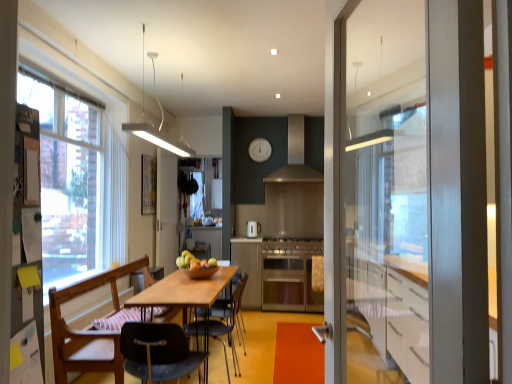
Question: Which direction should I rotate to look at metallic gray chair at center, the 3th chair positioned from the front, — up or down?

Choices:
 (A) up
 (B) down

Answer: (B)

Question: Is the depth of yellow matte apple at center less than that of stainless steel stove at center?

Choices:
 (A) yes
 (B) no

Answer: (A)

Question: Is yellow matte apple at center bigger than stainless steel stove at center?

Choices:
 (A) yes
 (B) no

Answer: (B)

Question: Considering the relative sizes of yellow matte apple at center and stainless steel stove at center in the image provided, is yellow matte apple at center smaller than stainless steel stove at center?

Choices:
 (A) yes
 (B) no

Answer: (A)

Question: Considering the relative sizes of yellow matte apple at center and stainless steel stove at center in the image provided, is yellow matte apple at center thinner than stainless steel stove at center?

Choices:
 (A) yes
 (B) no

Answer: (A)

Question: Does yellow matte apple at center appear on the right side of stainless steel stove at center?

Choices:
 (A) no
 (B) yes

Answer: (A)

Question: Does yellow matte apple at center turn towards stainless steel stove at center?

Choices:
 (A) no
 (B) yes

Answer: (B)

Question: Is the surface of satin silver oven at center in direct contact with white matte clock at upper center?

Choices:
 (A) yes
 (B) no

Answer: (B)

Question: Considering the relative sizes of satin silver oven at center and white matte clock at upper center in the image provided, is satin silver oven at center wider than white matte clock at upper center?

Choices:
 (A) no
 (B) yes

Answer: (B)

Question: From a real-world perspective, is satin silver oven at center over white matte clock at upper center?

Choices:
 (A) no
 (B) yes

Answer: (A)

Question: Is satin silver oven at center smaller than white matte clock at upper center?

Choices:
 (A) yes
 (B) no

Answer: (B)

Question: Can you confirm if satin silver oven at center is shorter than white matte clock at upper center?

Choices:
 (A) no
 (B) yes

Answer: (A)

Question: Is satin silver oven at center further to the viewer compared to white matte clock at upper center?

Choices:
 (A) yes
 (B) no

Answer: (B)

Question: Can you confirm if black plastic chair at center, the first chair when ordered from front to back, is wider than stainless steel stove at center?

Choices:
 (A) no
 (B) yes

Answer: (A)